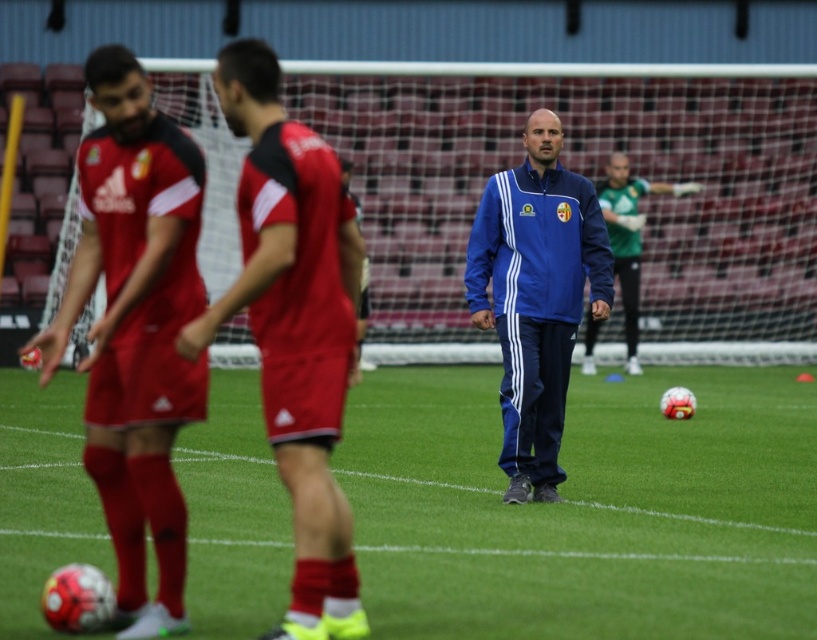
Question: Which of the following is the farthest from the observer?

Choices:
 (A) matte red soccer uniform at left
 (B) red jersey at center

Answer: (A)

Question: Based on their relative distances, which object is farther from the blue fabric jacket at center?

Choices:
 (A) red jersey at center
 (B) matte red soccer uniform at left

Answer: (B)

Question: Which is nearer to the blue fabric jacket at center?

Choices:
 (A) red jersey at center
 (B) matte red soccer uniform at left
 (C) green grass at center

Answer: (C)

Question: In this image, where is green grass at center located relative to red jersey at center?

Choices:
 (A) left
 (B) right

Answer: (B)

Question: Does green grass at center have a larger size compared to red jersey at center?

Choices:
 (A) no
 (B) yes

Answer: (B)

Question: Considering the relative positions of red jersey at center and blue fabric jacket at center in the image provided, where is red jersey at center located with respect to blue fabric jacket at center?

Choices:
 (A) below
 (B) above

Answer: (A)